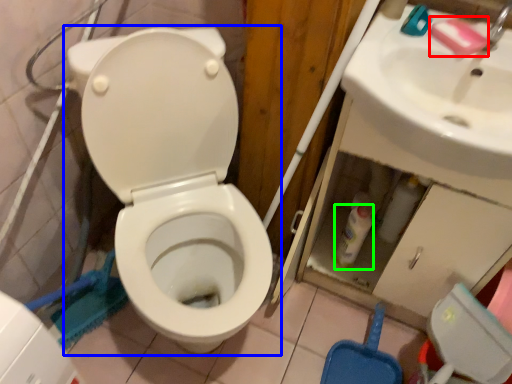
Question: Estimate the real-world distances between objects in this image. Which object is farther from soap (highlighted by a red box), toilet (highlighted by a blue box) or bottle (highlighted by a green box)?

Choices:
 (A) toilet
 (B) bottle

Answer: (A)